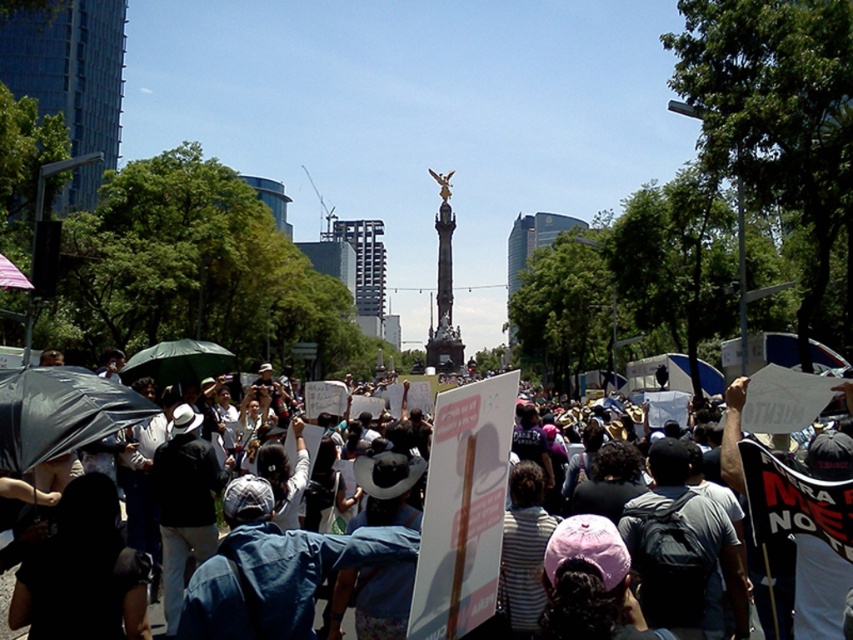
You are a photographer trying to capture a clear shot of the green matte umbrella at center without the denim jacket at center blocking it. Based on their sizes, which object should you adjust your focus to prioritize in the frame?

The denim jacket at center is larger than the green matte umbrella at center. To avoid blocking the umbrella, you should position your camera to focus on the smaller green matte umbrella at center while ensuring the larger denim jacket at center is either moved out of the frame or positioned behind it.

You are a photographer standing at the camera position. You want to capture a closeup shot of the denim jacket at center. Given that your telephoto lens can zoom up to 200 meters, will you be able to take the photo?

The denim jacket at center is 153.60 meters away from camera. Since the telephoto lens can zoom up to 200 meters, the photographer can take the closeup shot as the distance is within the lens capability.